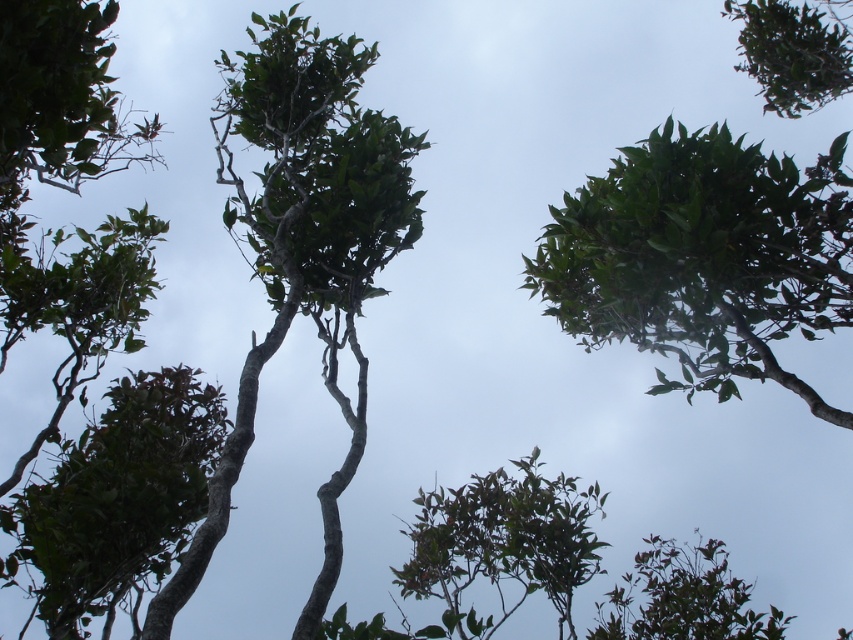
You are a bird trying to fly from the green matte tree at upper center to the green matte tree at center. Given that your wingspan is 3 feet, can you safely make this flight without touching the trees?

The distance between the green matte tree at upper center and the green matte tree at center is 7.63 feet. Since your wingspan is 3 feet, you have enough space to fly between them safely without touching the trees.